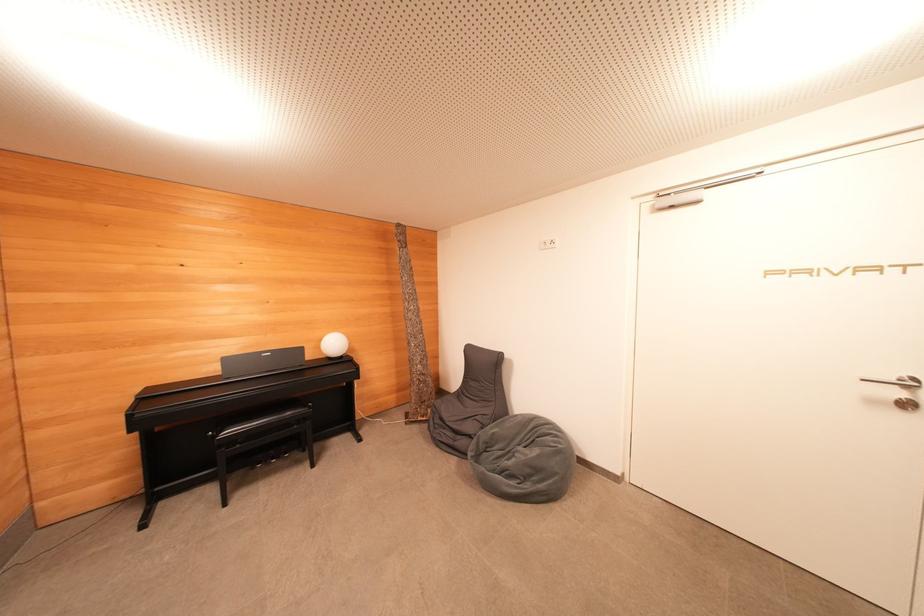
I want to click on piano key cover, so click(x=261, y=361).